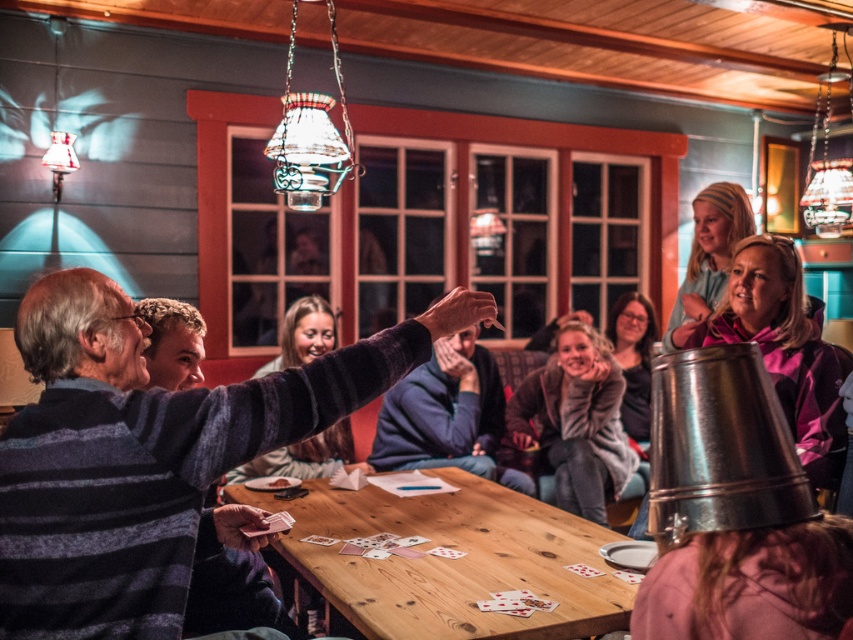
In the scene shown: Does striped sweater at center have a greater height compared to gray fuzzy coat at center?

No, striped sweater at center is not taller than gray fuzzy coat at center.

Who is more distant from viewer, (219, 394) or (604, 481)?

Point (604, 481)

Locate an element on the screen. striped sweater at center is located at coordinates (151, 460).

Is wooden table at center to the right of gray fuzzy coat at center from the viewer's perspective?

In fact, wooden table at center is to the left of gray fuzzy coat at center.

Is point (515, 564) in front of point (596, 419)?

Yes, it is.

Is point (535, 579) farther from viewer compared to point (605, 486)?

No, it is not.

Find the location of `wooden table at center`. wooden table at center is located at coordinates (451, 561).

Is wooden table at center smaller than purple fabric scarf at upper right?

No.

The height and width of the screenshot is (640, 853). What do you see at coordinates (451, 561) in the screenshot? I see `wooden table at center` at bounding box center [451, 561].

Find the location of a particular element. Image resolution: width=853 pixels, height=640 pixels. wooden table at center is located at coordinates (451, 561).